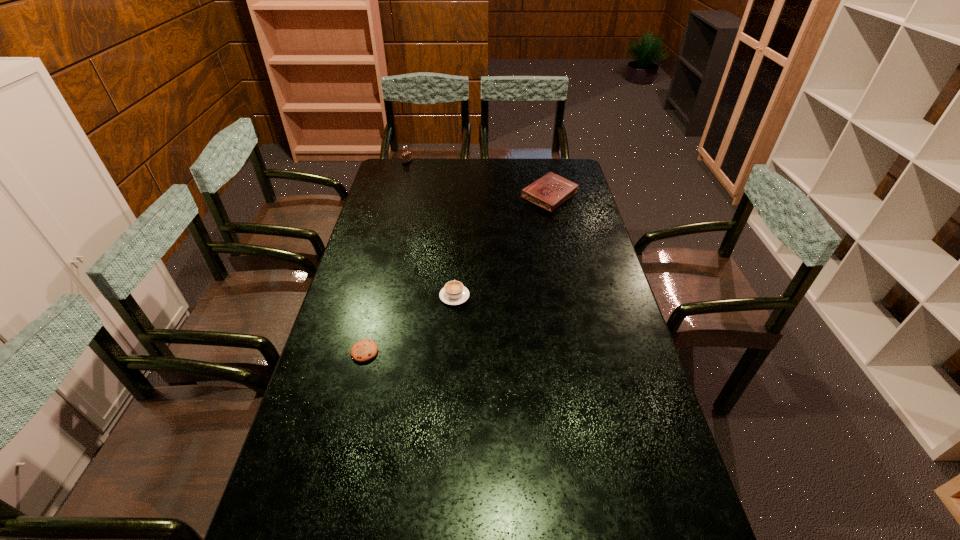
Where is `vacant space that is in between the third farthest object and the tallest object`? Image resolution: width=960 pixels, height=540 pixels. vacant space that is in between the third farthest object and the tallest object is located at coordinates (431, 230).

This screenshot has width=960, height=540. I want to click on free area in between the tallest object and the third object from left to right, so click(431, 230).

The height and width of the screenshot is (540, 960). What are the coordinates of `free area in between the rightmost object and the tallest object` in the screenshot? It's located at (478, 179).

This screenshot has width=960, height=540. I want to click on empty location between the farthest object and the nearest object, so click(x=386, y=257).

What are the coordinates of `vacant space that is in between the cookie and the third nearest object` in the screenshot? It's located at (457, 274).

This screenshot has height=540, width=960. I want to click on object that stands as the second closest to the third object from left to right, so click(x=550, y=191).

Locate an element on the screen. the third closest object to the farthest object is located at coordinates (364, 350).

Identify the location of vacant space that satisfies the following two spatial constraints: 1. on the front side of the third nearest object; 2. on the left side of the tallest object. The width and height of the screenshot is (960, 540). (398, 196).

Where is `free space that satisfies the following two spatial constraints: 1. on the back side of the shortest object; 2. on the left side of the rightmost object`? free space that satisfies the following two spatial constraints: 1. on the back side of the shortest object; 2. on the left side of the rightmost object is located at coordinates (402, 196).

I want to click on free region that satisfies the following two spatial constraints: 1. on the side of the second nearest object with the handle; 2. on the left side of the second farthest object, so click(461, 196).